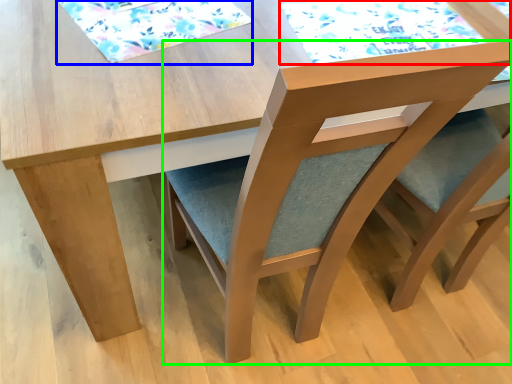
Question: Estimate the real-world distances between objects in this image. Which object is farther from mat (highlighted by a red box), mat (highlighted by a blue box) or chair (highlighted by a green box)?

Choices:
 (A) mat
 (B) chair

Answer: (B)